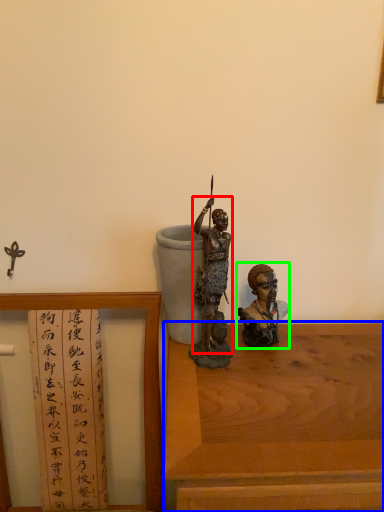
Question: Estimate the real-world distances between objects in this image. Which object is farther from person (highlighted by a red box), table (highlighted by a blue box) or person (highlighted by a green box)?

Choices:
 (A) table
 (B) person

Answer: (A)